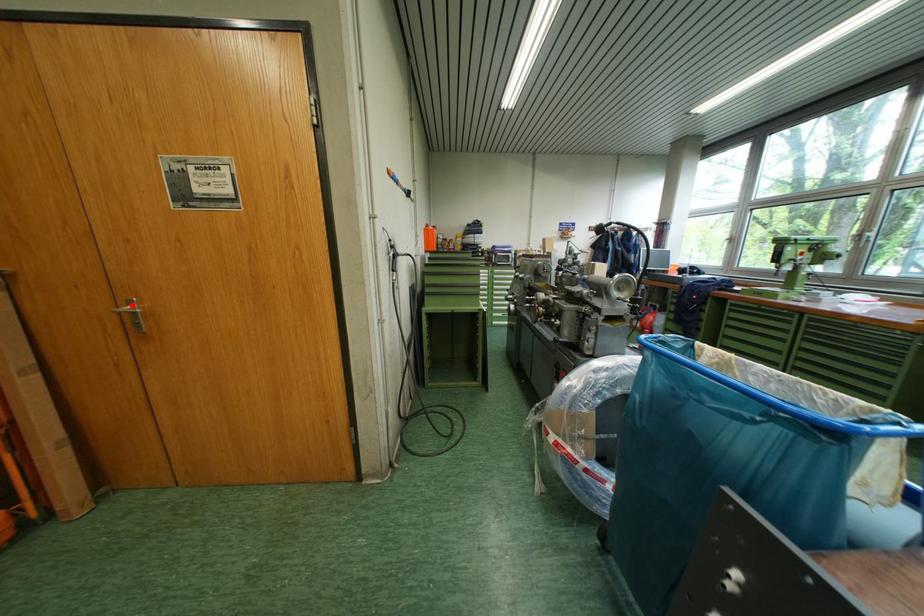
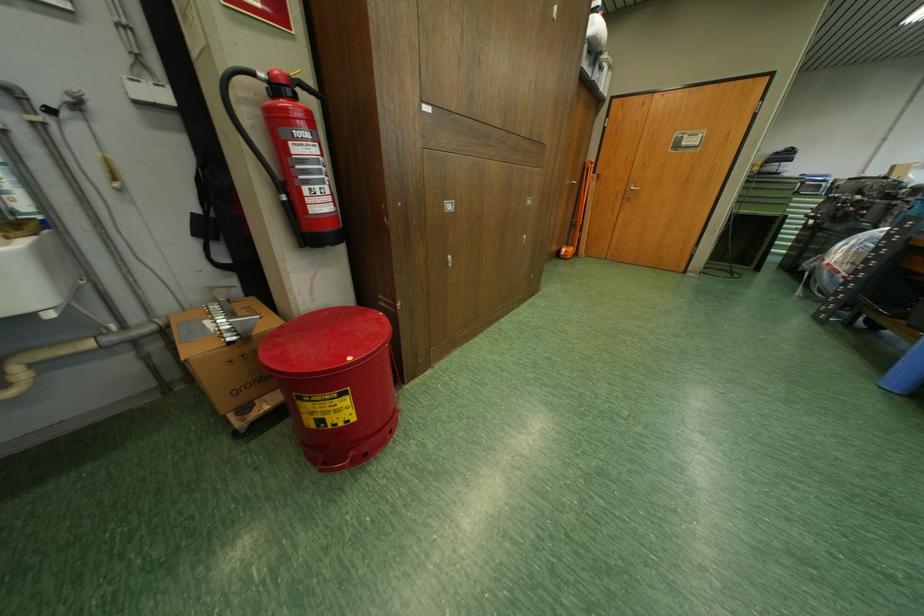
Question: I am providing you with two images of the same scene from different viewpoints. Given a red point in image1, look at the same physical point in image2. Is it:

Choices:
 (A) Closer to the viewpoint
 (B) Farther from the viewpoint

Answer: (A)